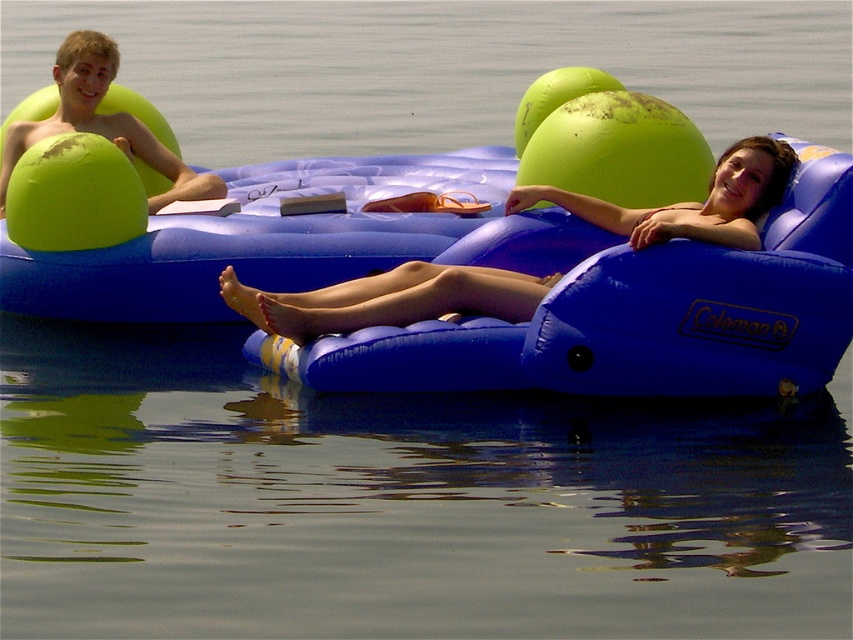
Which is behind, point (520, 72) or point (766, 166)?

The point (520, 72) is behind.

Is green rubber ball at upper center to the left of matte blue inflatable chair at center from the viewer's perspective?

Indeed, green rubber ball at upper center is positioned on the left side of matte blue inflatable chair at center.

Where is `green rubber ball at upper center`? The image size is (853, 640). green rubber ball at upper center is located at coordinates (440, 67).

Find the location of a particular element. The width and height of the screenshot is (853, 640). green rubber ball at upper center is located at coordinates (440, 67).

Which is more to the left, matte blue inflatable chair at center or matte green ball at upper left?

From the viewer's perspective, matte green ball at upper left appears more on the left side.

Is point (614, 209) positioned after point (88, 54)?

That is False.

Locate an element on the screen. matte blue inflatable chair at center is located at coordinates (390, 300).

Which is more to the left, green rubber ball at upper center or matte green ball at upper left?

Positioned to the left is matte green ball at upper left.

Does green rubber ball at upper center have a smaller size compared to matte green ball at upper left?

No.

Which is behind, point (401, 54) or point (91, 49)?

Point (401, 54)

Where is `green rubber ball at upper center`? This screenshot has height=640, width=853. green rubber ball at upper center is located at coordinates (440, 67).